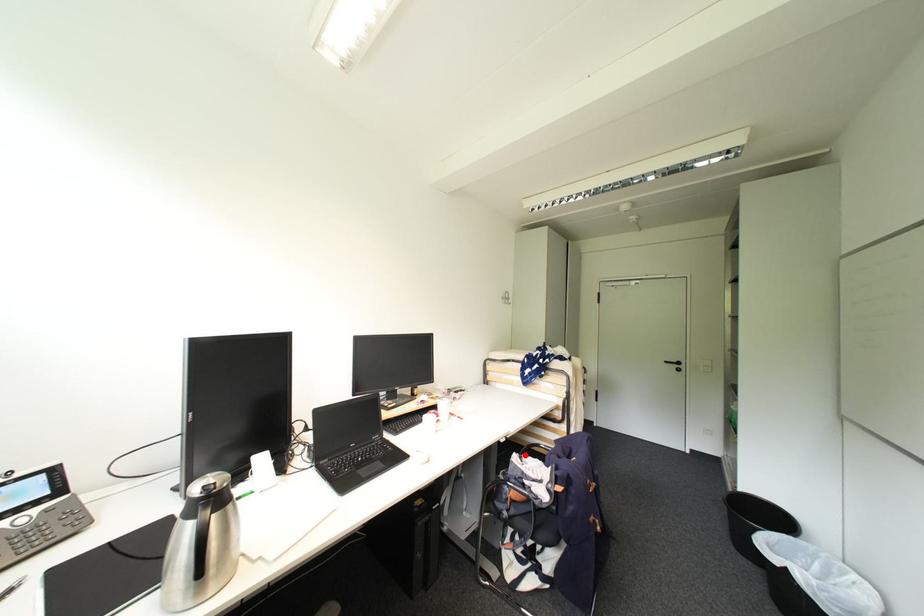
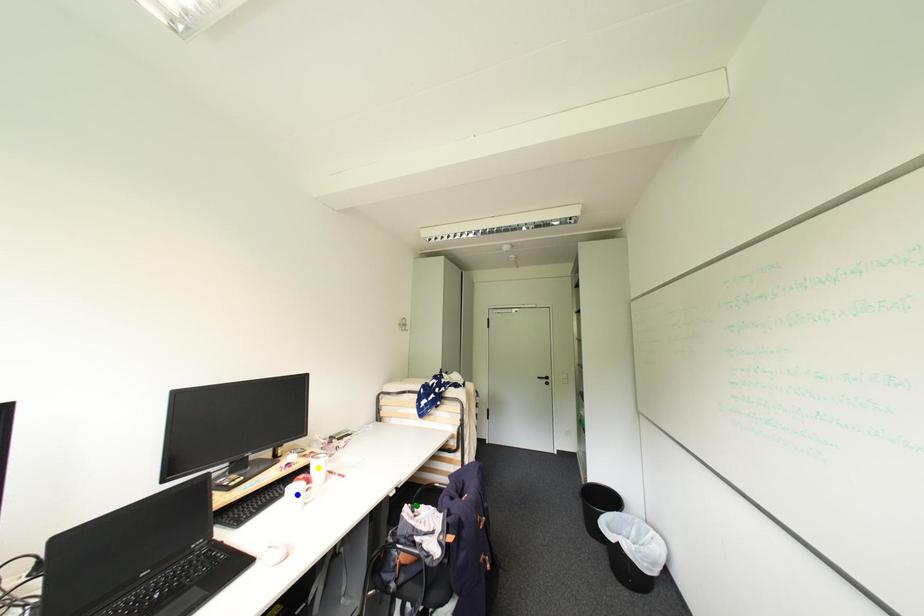
Question: I am providing you with two images of the same scene from different viewpoints. A red point is marked on the first image. You are given multiple points on the second image. Can you choose the point in image 2 that corresponds to the point in image 1?

Choices:
 (A) green point
 (B) blue point
 (C) yellow point

Answer: (A)